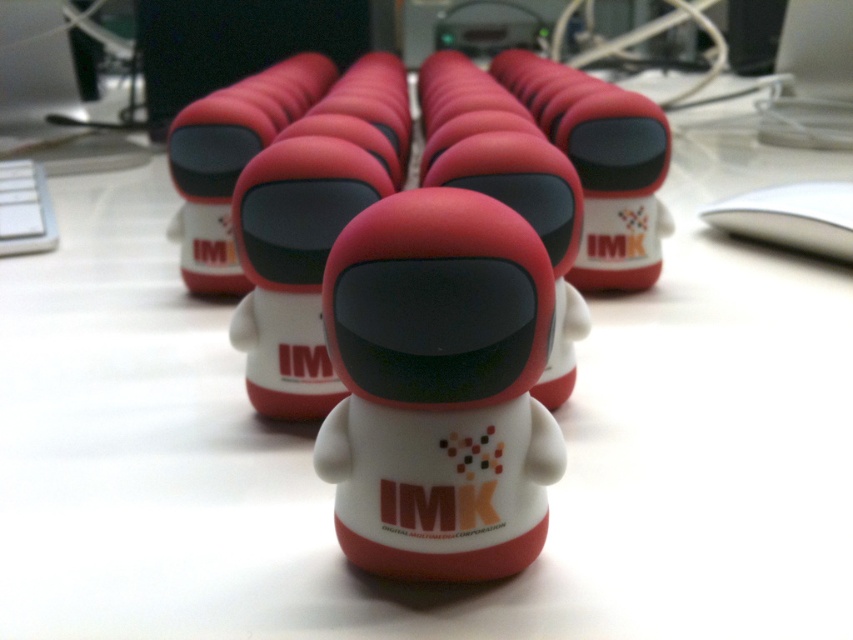
You are organizing a desk and need to place the matte plastic toy at center and the white matte robot at center into a storage box. The box can only accommodate items up to the height of the shorter object. Which object should you prioritize placing first to ensure both fit?

The matte plastic toy at center is much taller than the white matte robot at center. To ensure both fit in the box, you should place the taller matte plastic toy at center first, then the shorter white matte robot at center on top or beside it.

You are organizing a desk and want to place both the matte plastic figurine at center and the matte plastic toy at center. Since space is limited, which one should you choose to keep if you can only keep one?

The matte plastic figurine at center occupies less space than the matte plastic toy at center, so you should choose to keep the matte plastic figurine at center to save space.